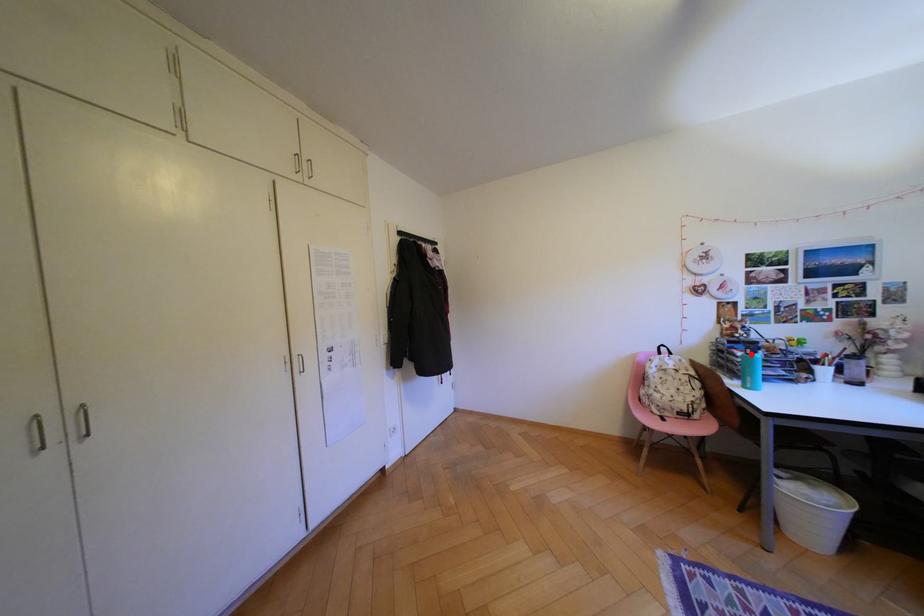
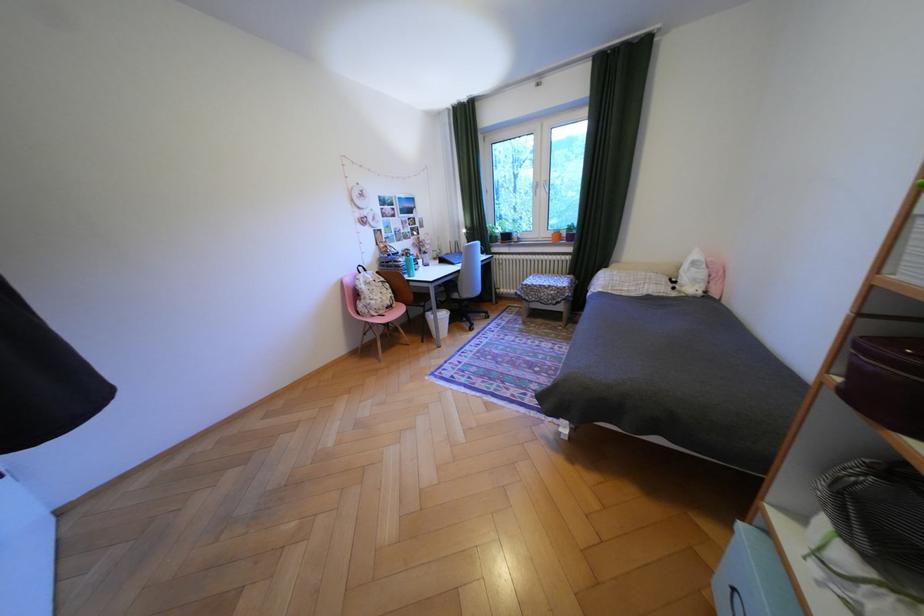
Where in the second image is the point corresponding to the highlighted location from the first image?

(411, 259)